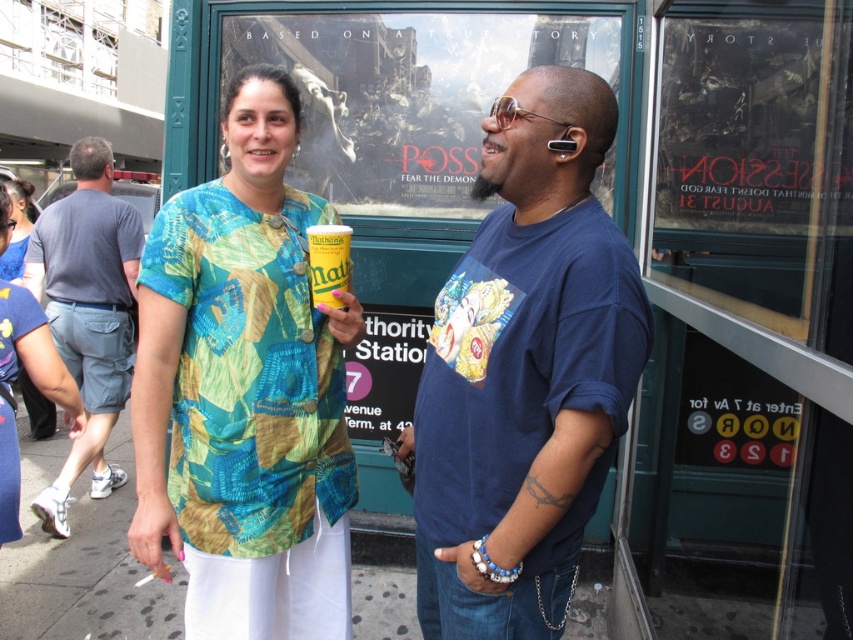
Question: Is printed fabric shirt at center smaller than yellow matte can at center?

Choices:
 (A) no
 (B) yes

Answer: (A)

Question: Which object is the closest to the printed fabric shirt at center?

Choices:
 (A) yellow matte can at center
 (B) gray cotton shorts at left

Answer: (A)

Question: Is printed fabric shirt at center further to the viewer compared to gray cotton shorts at left?

Choices:
 (A) no
 (B) yes

Answer: (A)

Question: Is printed fabric shirt at center below yellow matte can at center?

Choices:
 (A) no
 (B) yes

Answer: (B)

Question: Estimate the real-world distances between objects in this image. Which object is farther from the printed fabric shirt at center?

Choices:
 (A) blue cotton t-shirt at center
 (B) gray cotton shorts at left
 (C) yellow matte can at center

Answer: (B)

Question: Among these objects, which one is farthest from the camera?

Choices:
 (A) yellow matte can at center
 (B) gray cotton shorts at left

Answer: (B)